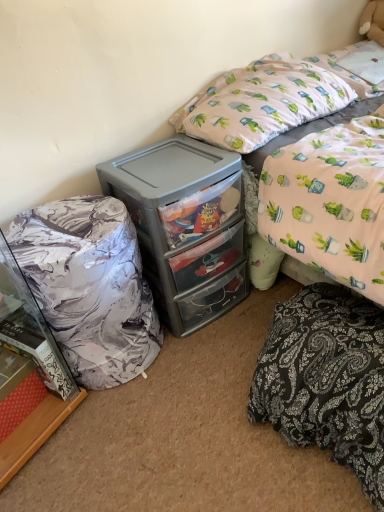
Find the location of a particular element. pink fabric pillow at upper right is located at coordinates (261, 102).

The image size is (384, 512). What do you see at coordinates (90, 286) in the screenshot? I see `marble-patterned bean bag at left` at bounding box center [90, 286].

Where is `gray plastic chest of drawers at center`? This screenshot has height=512, width=384. gray plastic chest of drawers at center is located at coordinates (185, 226).

At what (x,y) coordinates should I click in order to perform the action: click on pink fabric bed at upper right. Please return your answer as a coordinate pair (x, y). Looking at the image, I should click on (276, 102).

From the image's perspective, who appears lower, black paisley fabric at lower right or marble-patterned cabinet at left?

From the image's view, black paisley fabric at lower right is below.

Is black paisley fabric at lower right outside of marble-patterned cabinet at left?

Absolutely, black paisley fabric at lower right is external to marble-patterned cabinet at left.

Does black paisley fabric at lower right lie behind marble-patterned cabinet at left?

Yes, black paisley fabric at lower right is behind marble-patterned cabinet at left.

Image resolution: width=384 pixels, height=512 pixels. Identify the location of chest of drawers behind the marble-patterned cabinet at left. (185, 226).

From the picture: From the image's perspective, which object appears higher, gray plastic chest of drawers at center or marble-patterned cabinet at left?

gray plastic chest of drawers at center.

In terms of height, does gray plastic chest of drawers at center look taller or shorter compared to marble-patterned cabinet at left?

gray plastic chest of drawers at center is shorter than marble-patterned cabinet at left.

Is point (165, 291) less distant than point (3, 443)?

That is False.

Is black paisley fabric at lower right further to the viewer compared to white plush teddy bear at upper right?

No, it is not.

Which is in front, point (345, 295) or point (364, 15)?

Positioned in front is point (345, 295).

Does black paisley fabric at lower right have a lesser height compared to white plush teddy bear at upper right?

No, black paisley fabric at lower right is not shorter than white plush teddy bear at upper right.

From a real-world perspective, who is located higher, black paisley fabric at lower right or white plush teddy bear at upper right?

In real-world perspective, white plush teddy bear at upper right is above.

Which of these two, gray plastic chest of drawers at center or white plush teddy bear at upper right, is smaller?

Smaller between the two is white plush teddy bear at upper right.

Can you tell me how much gray plastic chest of drawers at center and white plush teddy bear at upper right differ in facing direction?

32 degrees separate the facing orientations of gray plastic chest of drawers at center and white plush teddy bear at upper right.

Is gray plastic chest of drawers at center next to white plush teddy bear at upper right?

No, gray plastic chest of drawers at center is not touching white plush teddy bear at upper right.

The width and height of the screenshot is (384, 512). What are the coordinates of `teddy bear that is above the gray plastic chest of drawers at center (from the image's perspective)` in the screenshot? It's located at (373, 21).

From a real-world perspective, is pink fabric bed at upper right beneath pink fabric pillow at upper right?

Yes, from a real-world perspective, pink fabric bed at upper right is below pink fabric pillow at upper right.

Is pink fabric bed at upper right wider or thinner than pink fabric pillow at upper right?

Clearly, pink fabric bed at upper right has more width compared to pink fabric pillow at upper right.

Is pink fabric bed at upper right in contact with pink fabric pillow at upper right?

Yes, pink fabric bed at upper right is next to pink fabric pillow at upper right.

Which of these two, gray plastic chest of drawers at center or black paisley fabric at lower right, is wider?

With larger width is black paisley fabric at lower right.

Which object is positioned more to the left, gray plastic chest of drawers at center or black paisley fabric at lower right?

gray plastic chest of drawers at center.

What's the angular difference between gray plastic chest of drawers at center and black paisley fabric at lower right's facing directions?

gray plastic chest of drawers at center and black paisley fabric at lower right are facing 4.97 degrees away from each other.

Which is in front, gray plastic chest of drawers at center or black paisley fabric at lower right?

Positioned in front is black paisley fabric at lower right.

The image size is (384, 512). Find the location of `mattress below the pink fabric pillow at upper right (from a real-world perspective)`. mattress below the pink fabric pillow at upper right (from a real-world perspective) is located at coordinates (326, 380).

What's the angular difference between black paisley fabric at lower right and pink fabric pillow at upper right's facing directions?

0.418 degrees separate the facing orientations of black paisley fabric at lower right and pink fabric pillow at upper right.

Is black paisley fabric at lower right directly adjacent to pink fabric pillow at upper right?

There is a gap between black paisley fabric at lower right and pink fabric pillow at upper right.

Can you confirm if black paisley fabric at lower right is bigger than pink fabric pillow at upper right?

Incorrect, black paisley fabric at lower right is not larger than pink fabric pillow at upper right.

This screenshot has width=384, height=512. Identify the location of mattress that appears on the right of marble-patterned cabinet at left. click(x=326, y=380).

The width and height of the screenshot is (384, 512). Find the location of `cabinetry lying on the left of gray plastic chest of drawers at center`. cabinetry lying on the left of gray plastic chest of drawers at center is located at coordinates (28, 372).

Which object lies further to the anchor point marble-patterned cabinet at left, marble-patterned bean bag at left or pink fabric pillow at upper right?

Among the two, pink fabric pillow at upper right is located further to marble-patterned cabinet at left.

From the image, which object appears to be nearer to gray plastic chest of drawers at center, marble-patterned cabinet at left or white plush teddy bear at upper right?

Based on the image, marble-patterned cabinet at left appears to be nearer to gray plastic chest of drawers at center.

From the image, which object appears to be farther from black paisley fabric at lower right, pink fabric bed at upper right or gray plastic chest of drawers at center?

gray plastic chest of drawers at center is positioned further to the anchor black paisley fabric at lower right.

Estimate the real-world distances between objects in this image. Which object is further from gray plastic chest of drawers at center, pink fabric pillow at upper right or white plush teddy bear at upper right?

white plush teddy bear at upper right is further to gray plastic chest of drawers at center.

When comparing their distances from marble-patterned cabinet at left, does white plush teddy bear at upper right or pink fabric pillow at upper right seem closer?

pink fabric pillow at upper right lies closer to marble-patterned cabinet at left than the other object.

Which object lies further to the anchor point marble-patterned bean bag at left, black paisley fabric at lower right or marble-patterned cabinet at left?

Among the two, black paisley fabric at lower right is located further to marble-patterned bean bag at left.

Estimate the real-world distances between objects in this image. Which object is closer to marble-patterned cabinet at left, marble-patterned bean bag at left or white plush teddy bear at upper right?

The object closer to marble-patterned cabinet at left is marble-patterned bean bag at left.

Which object lies further to the anchor point gray plastic chest of drawers at center, marble-patterned bean bag at left or pink fabric bed at upper right?

pink fabric bed at upper right is further to gray plastic chest of drawers at center.

Find the location of `the chest of drawers that lies between white plush teddy bear at upper right and marble-patterned bean bag at left from top to bottom`. the chest of drawers that lies between white plush teddy bear at upper right and marble-patterned bean bag at left from top to bottom is located at coordinates (x=185, y=226).

Locate an element on the screen. The height and width of the screenshot is (512, 384). pillow that lies between white plush teddy bear at upper right and marble-patterned bean bag at left from top to bottom is located at coordinates (261, 102).

Identify the location of bed between white plush teddy bear at upper right and gray plastic chest of drawers at center in the up-down direction. (276, 102).

Where is `the chest of drawers located between marble-patterned bean bag at left and black paisley fabric at lower right in the left-right direction`? the chest of drawers located between marble-patterned bean bag at left and black paisley fabric at lower right in the left-right direction is located at coordinates point(185,226).